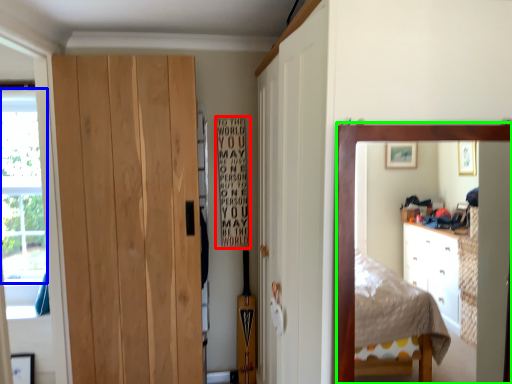
Question: Considering the real-world distances, which object is closest to bulletin board (highlighted by a red box)? window screen (highlighted by a blue box) or mirror (highlighted by a green box).

Choices:
 (A) window screen
 (B) mirror

Answer: (A)